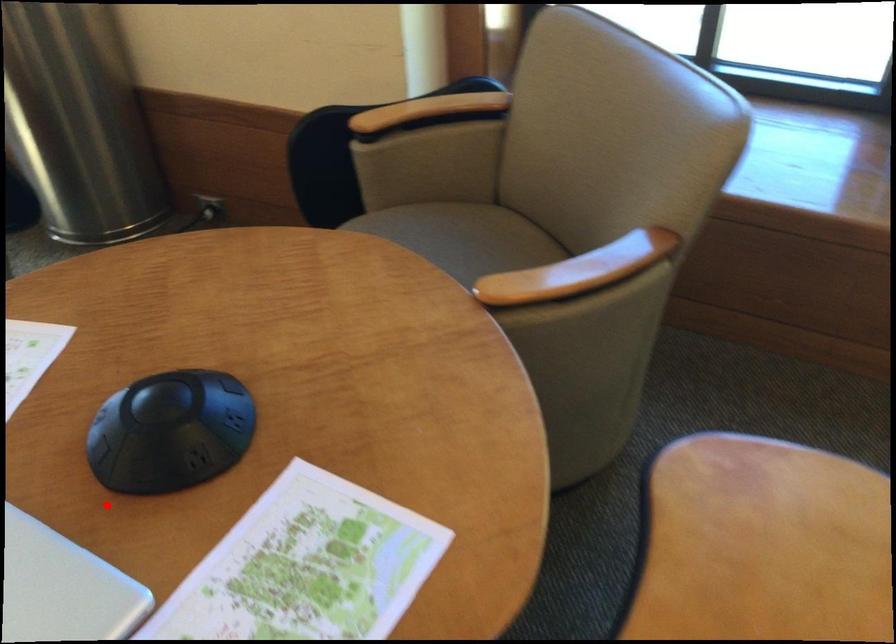
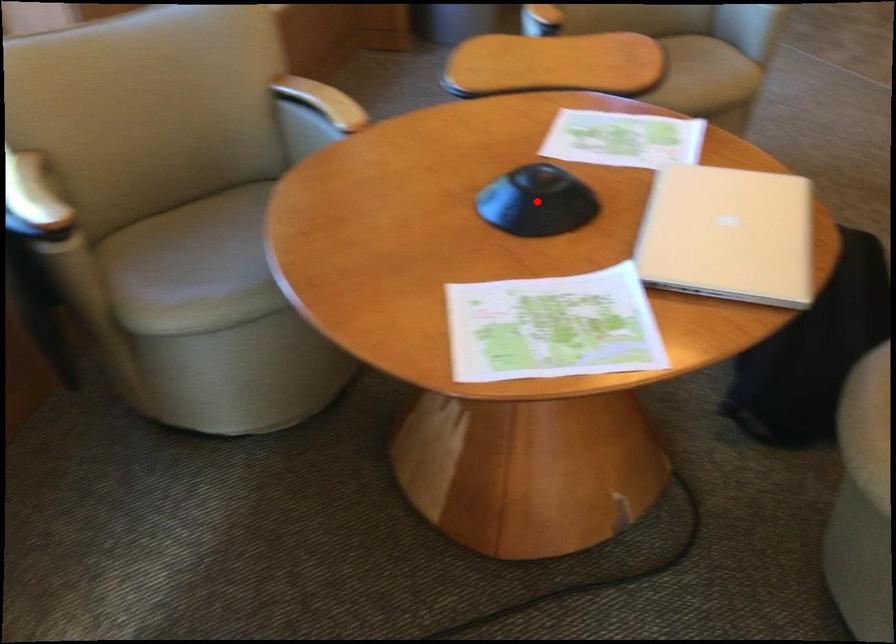
I am providing you with two images of the same scene from different viewpoints. A red point is marked on the first image and another point is marked on the second image. Do the highlighted points in image1 and image2 indicate the same real-world spot?

Yes